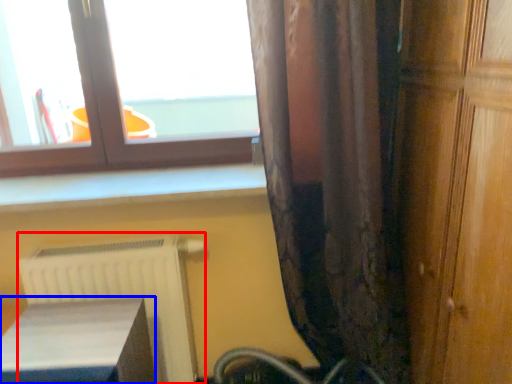
Question: Which of the following is the farthest to the observer, radiator (highlighted by a red box) or furniture (highlighted by a blue box)?

Choices:
 (A) radiator
 (B) furniture

Answer: (A)